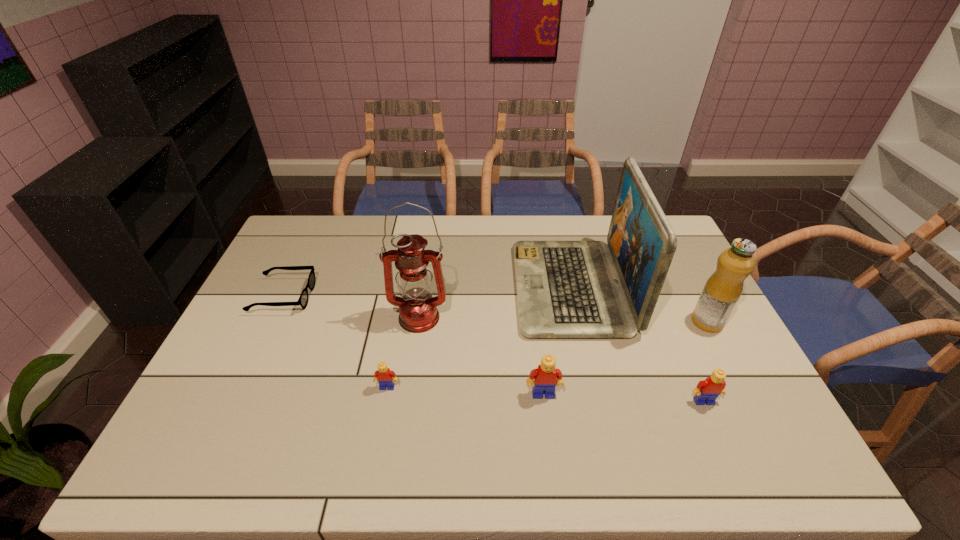
You are a GUI agent. You are given a task and a screenshot of the screen. Output one action in this format:
    pyautogui.click(x=<x>, y=<y>)
    Task: Click on the object that is the third closest to the oil lamp
    
    Given the screenshot: What is the action you would take?
    pyautogui.click(x=303, y=299)

Identify which object is the nearest to the second Lego from right to left. Please provide its 2D coordinates. Your answer should be formatted as a tuple, i.e. [(x, y)], where the tuple contains the x and y coordinates of a point satisfying the conditions above.

[(565, 289)]

The width and height of the screenshot is (960, 540). In order to click on Lego that is the second closest to the laptop computer in this screenshot , I will do `click(707, 390)`.

This screenshot has width=960, height=540. Find the location of `the third closest Lego relative to the laptop computer`. the third closest Lego relative to the laptop computer is located at coordinates (383, 375).

The image size is (960, 540). I want to click on free spot that satisfies the following two spatial constraints: 1. on the arms of the oil lamp; 2. on the right side of the spectacles, so click(x=274, y=318).

Find the location of a particular element. This screenshot has width=960, height=540. vacant position in the image that satisfies the following two spatial constraints: 1. on the front label of the fruit juice; 2. on the face of the shortest Lego is located at coordinates (741, 387).

Find the location of a particular element. vacant space that satisfies the following two spatial constraints: 1. on the front label of the rightmost object; 2. on the face of the rightmost Lego is located at coordinates (748, 401).